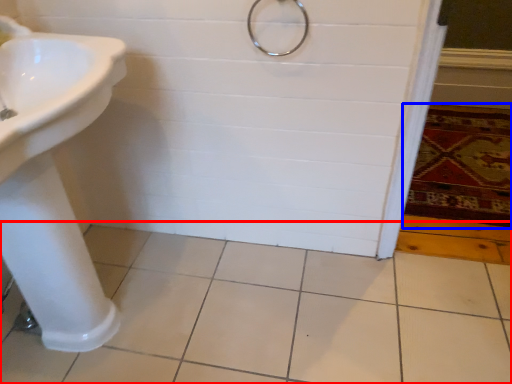
Question: Which point is closer to the camera, ceramic tile (highlighted by a red box) or bath mat (highlighted by a blue box)?

Choices:
 (A) ceramic tile
 (B) bath mat

Answer: (A)